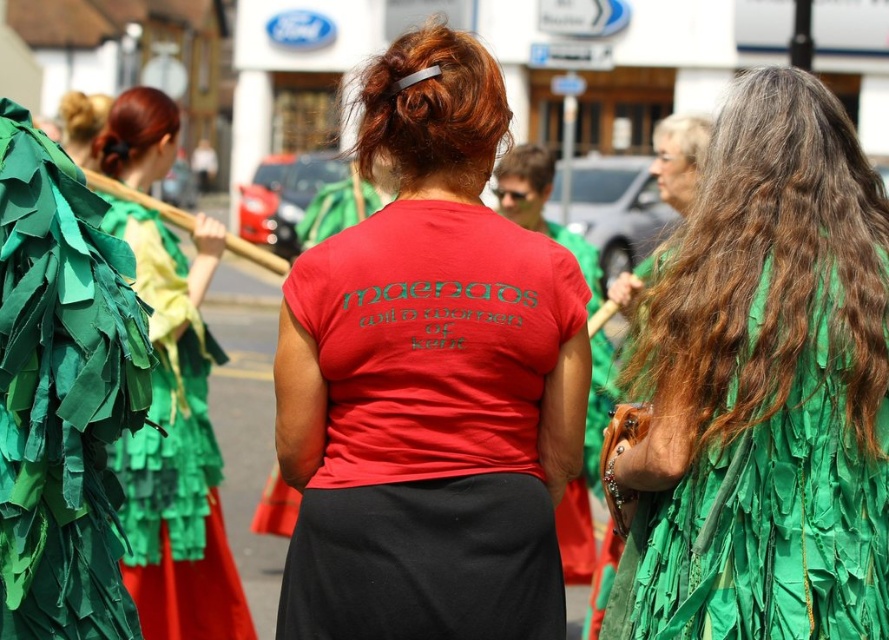
Question: Which point is closer to the camera?

Choices:
 (A) grayish-brown silky hair at right
 (B) brownhair at center
 (C) green fabric leaves at left

Answer: (A)

Question: Is matte red t-shirt at center smaller than blondehair at upper left?

Choices:
 (A) yes
 (B) no

Answer: (A)

Question: Which point is closer to the camera?

Choices:
 (A) gray/straight hair at upper center
 (B) grayish-brown silky hair at right
 (C) matte red t-shirt at center

Answer: (B)

Question: Which object is farther from the camera taking this photo?

Choices:
 (A) grayish-brown silky hair at right
 (B) green fringed dress at right
 (C) gray/straight hair at upper center

Answer: (C)

Question: Can you confirm if green paper leaves at left is bigger than dark brown silky hair at upper left?

Choices:
 (A) no
 (B) yes

Answer: (A)

Question: Is brownhair bandhair at center bigger than brownhair at center?

Choices:
 (A) no
 (B) yes

Answer: (A)